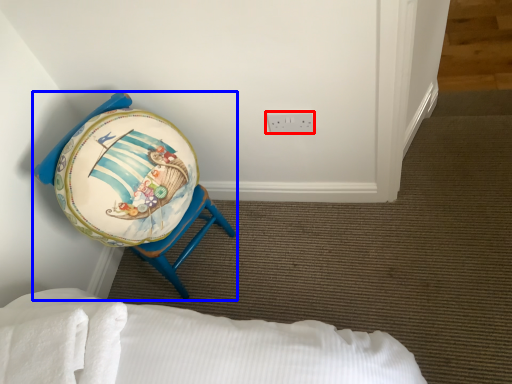
Question: Among these objects, which one is nearest to the camera, electric outlet (highlighted by a red box) or furniture (highlighted by a blue box)?

Choices:
 (A) electric outlet
 (B) furniture

Answer: (B)